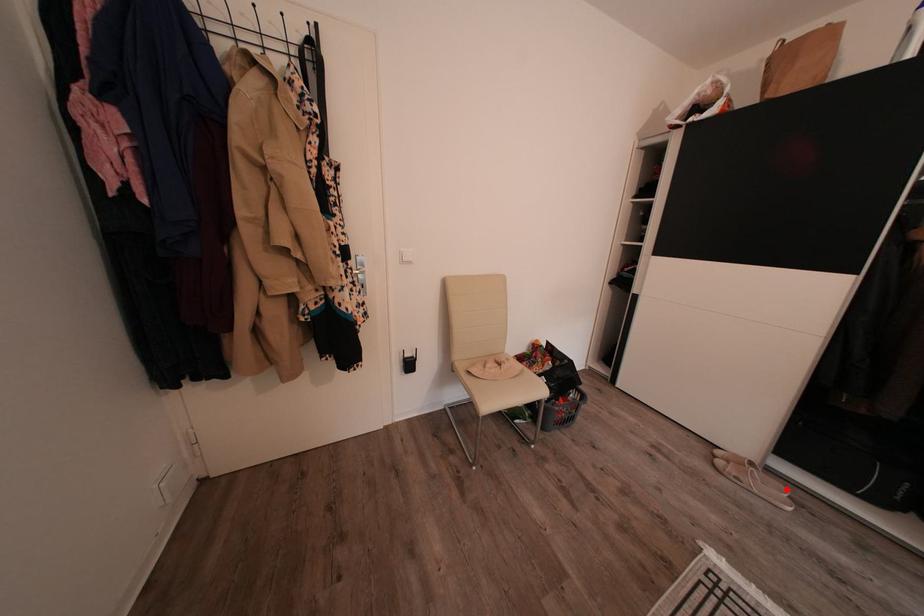
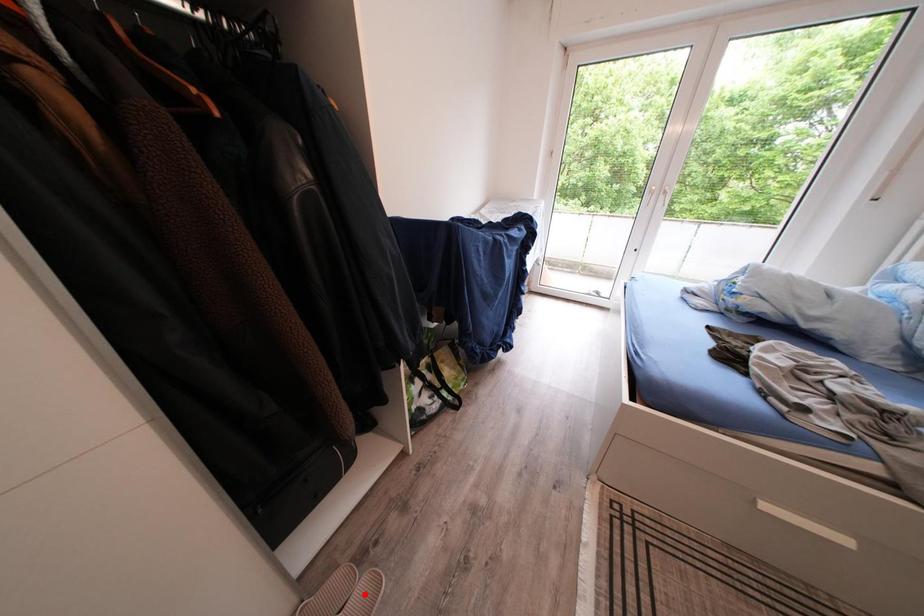
I am providing you with two images of the same scene from different viewpoints. A red point is marked on the first image and another point is marked on the second image. Do the highlighted points in image1 and image2 indicate the same real-world spot?

No